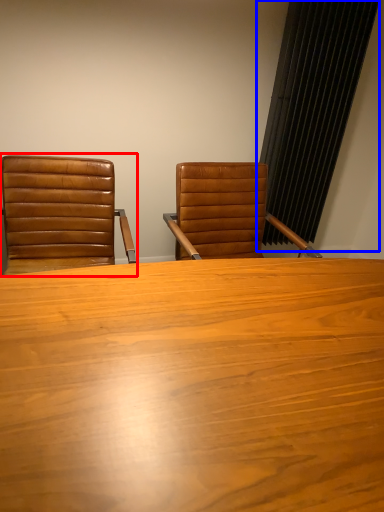
Question: Which object appears closest to the camera in this image, chair (highlighted by a red box) or curtain (highlighted by a blue box)?

Choices:
 (A) chair
 (B) curtain

Answer: (A)